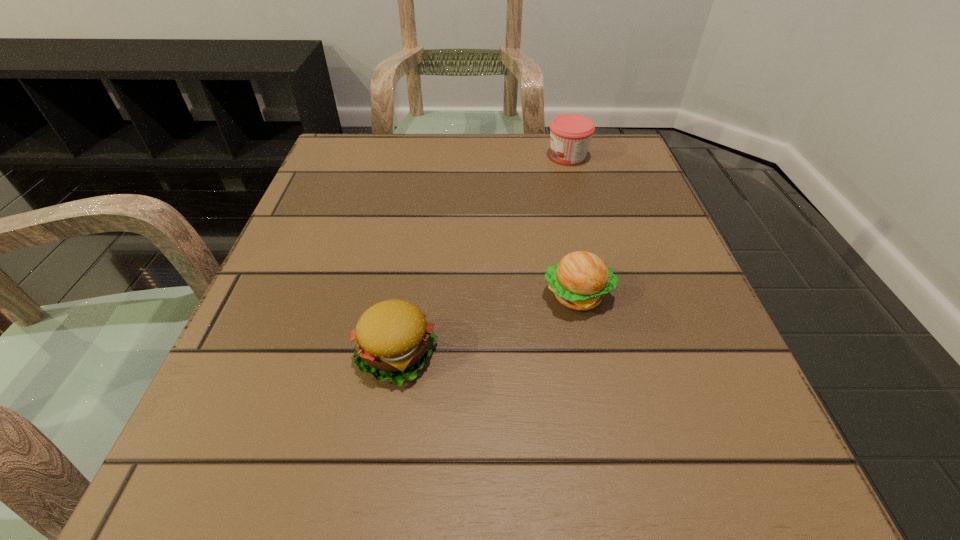
Find the location of a particular element. This screenshot has width=960, height=540. jam is located at coordinates click(x=570, y=134).

Find the location of a particular element. Image resolution: width=960 pixels, height=540 pixels. the right hamburger is located at coordinates (580, 280).

The image size is (960, 540). Identify the location of the farther hamburger. (580, 280).

Identify the location of the nearest object. Image resolution: width=960 pixels, height=540 pixels. (394, 340).

The height and width of the screenshot is (540, 960). I want to click on the nearer hamburger, so click(x=394, y=340).

Where is `vacant space located 0.280m on the front label of the farthest object`? vacant space located 0.280m on the front label of the farthest object is located at coordinates (424, 156).

At what (x,y) coordinates should I click in order to perform the action: click on vacant space positioned on the front label of the farthest object. Please return your answer as a coordinate pair (x, y). This screenshot has width=960, height=540. Looking at the image, I should click on (376, 156).

At what (x,y) coordinates should I click in order to perform the action: click on vacant region located on the front label of the farthest object. Please return your answer as a coordinate pair (x, y). The height and width of the screenshot is (540, 960). Looking at the image, I should click on (442, 156).

Where is `vacant position located 0.370m on the back of the second farthest object`? The height and width of the screenshot is (540, 960). vacant position located 0.370m on the back of the second farthest object is located at coordinates (549, 159).

Find the location of a particular element. blank space located on the back of the left hamburger is located at coordinates (408, 289).